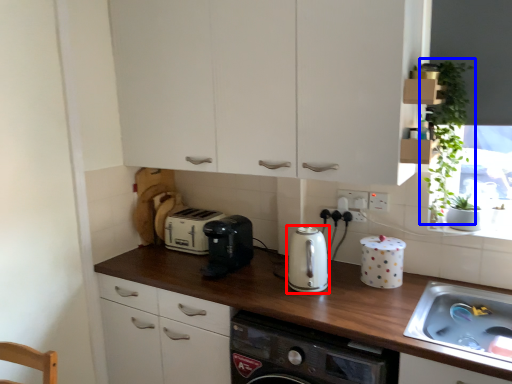
Question: Which point is further to the camera, kitchen appliance (highlighted by a red box) or plant (highlighted by a blue box)?

Choices:
 (A) kitchen appliance
 (B) plant

Answer: (A)